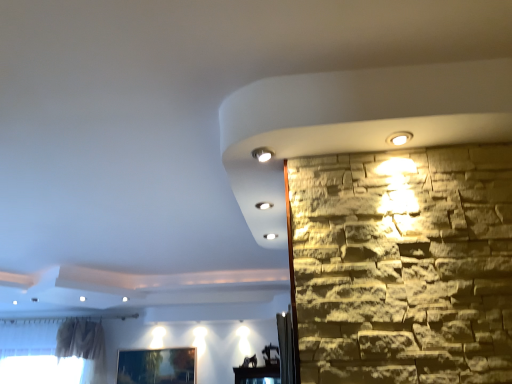
Question: Is matte white spotlight at upper center at the right side of metallic silver picture frame at lower left?

Choices:
 (A) yes
 (B) no

Answer: (A)

Question: From a real-world perspective, is matte white spotlight at upper center physically above metallic silver picture frame at lower left?

Choices:
 (A) no
 (B) yes

Answer: (B)

Question: Is the depth of matte white spotlight at upper center greater than that of metallic silver picture frame at lower left?

Choices:
 (A) yes
 (B) no

Answer: (B)

Question: Considering the relative sizes of matte white spotlight at upper center and metallic silver picture frame at lower left in the image provided, is matte white spotlight at upper center smaller than metallic silver picture frame at lower left?

Choices:
 (A) yes
 (B) no

Answer: (A)

Question: Considering the relative sizes of matte white spotlight at upper center and metallic silver picture frame at lower left in the image provided, is matte white spotlight at upper center bigger than metallic silver picture frame at lower left?

Choices:
 (A) no
 (B) yes

Answer: (A)

Question: Is matte white spotlight at upper center facing away from metallic silver picture frame at lower left?

Choices:
 (A) yes
 (B) no

Answer: (B)

Question: Considering the relative positions of metallic silver picture frame at lower left and matte white spotlight at upper center in the image provided, is metallic silver picture frame at lower left behind matte white spotlight at upper center?

Choices:
 (A) yes
 (B) no

Answer: (A)

Question: Is metallic silver picture frame at lower left located outside matte white spotlight at upper center?

Choices:
 (A) yes
 (B) no

Answer: (A)

Question: Does metallic silver picture frame at lower left appear on the left side of matte white spotlight at upper center?

Choices:
 (A) no
 (B) yes

Answer: (B)

Question: Can you confirm if metallic silver picture frame at lower left is shorter than matte white spotlight at upper center?

Choices:
 (A) yes
 (B) no

Answer: (B)

Question: Does metallic silver picture frame at lower left have a larger size compared to matte white spotlight at upper center?

Choices:
 (A) no
 (B) yes

Answer: (B)

Question: Is metallic silver picture frame at lower left in front of matte white spotlight at upper center?

Choices:
 (A) no
 (B) yes

Answer: (A)

Question: Relative to metallic silver picture frame at lower left, is matte white spotlight at upper center in front or behind?

Choices:
 (A) front
 (B) behind

Answer: (A)